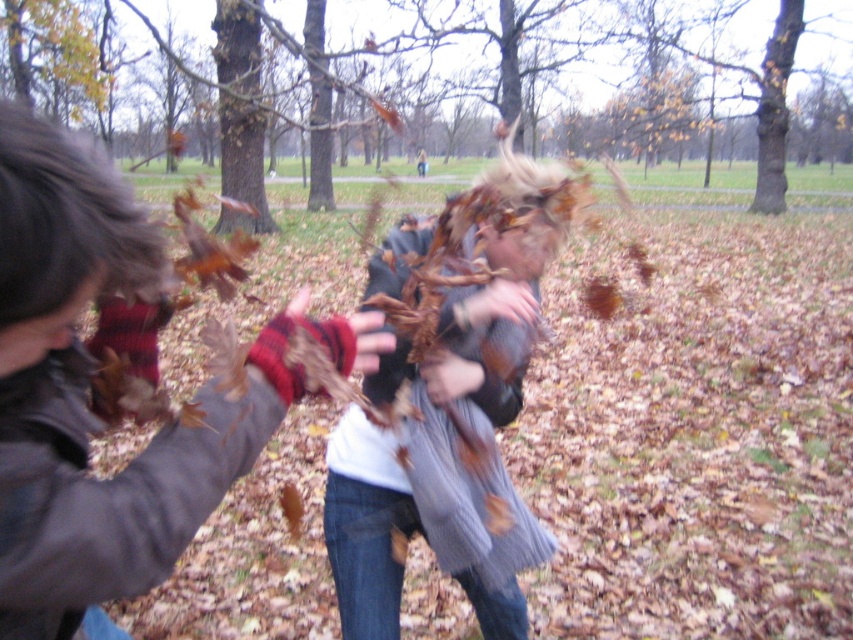
Question: Is plaid wool mittens at left thinner than gray knitted sweater at center?

Choices:
 (A) yes
 (B) no

Answer: (A)

Question: Does plaid wool mittens at left have a lesser width compared to gray knitted sweater at center?

Choices:
 (A) yes
 (B) no

Answer: (A)

Question: Which point is farther to the camera?

Choices:
 (A) (212, 412)
 (B) (462, 381)

Answer: (B)

Question: Which of the following is the farthest from the observer?

Choices:
 (A) (91, 570)
 (B) (466, 296)

Answer: (B)

Question: Is plaid wool mittens at left in front of gray knitted sweater at center?

Choices:
 (A) yes
 (B) no

Answer: (A)